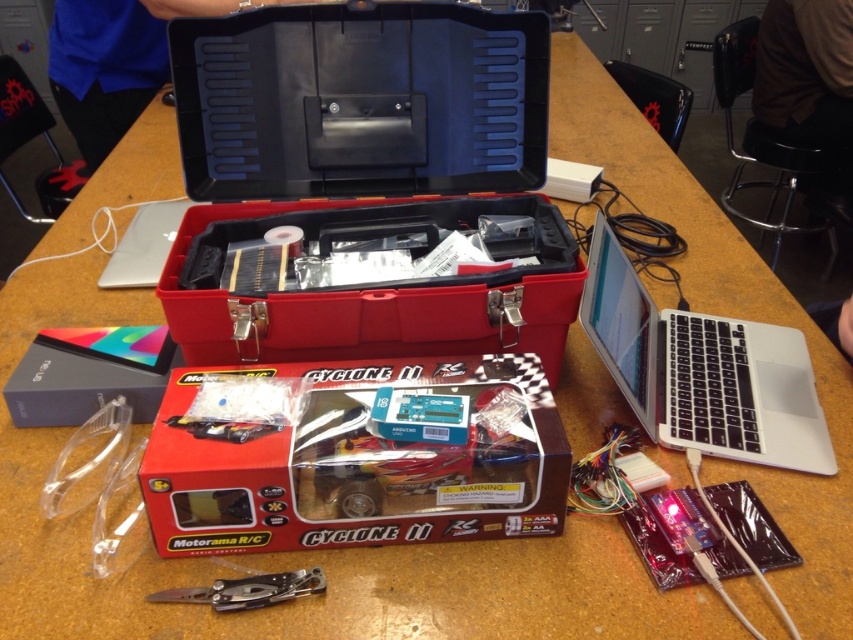
You are setting up your workspace to assemble an RC car. You have a red plastic cyclone ii rc car box at center and a silver metallic laptop at right. Which object is closer to you?

The red plastic cyclone ii rc car box at center is closer to you because it is in front of the silver metallic laptop at right.

You need to place both the red plastic cyclone ii rc car box at center and the silver metallic laptop at right into a storage cabinet. The cabinet has a shelf that can only hold items up to 50 cm in width. Given their sizes, can both items fit side by side on the shelf?

The red plastic cyclone ii rc car box at center is wider than the silver metallic laptop at right. However, since the shelf can only hold items up to 50 cm, we need to know their exact widths. Unfortunately, the description does not provide specific measurements for either item. Therefore, it is impossible to determine if they can fit side by side based on the given information.

You are a technician trying to locate two points marked on the workspace. The first point is at coordinate point(734,339) and the second is at point(229,440). Which point is closer to you?

Point(734,339) is further to the camera than point(229,440), so the point closer to you is point(229,440).